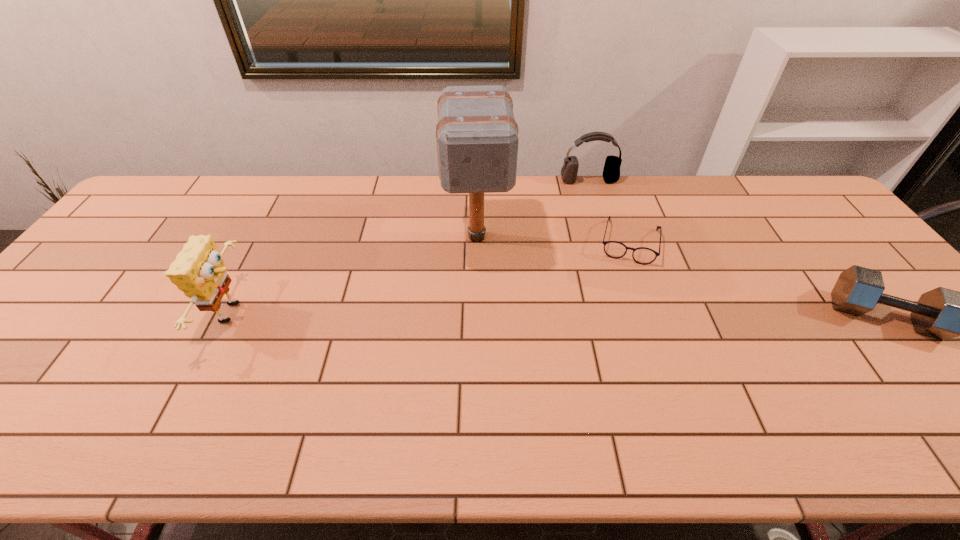
Where is `the leftmost object`? the leftmost object is located at coordinates (199, 271).

Locate an element on the screen. This screenshot has height=540, width=960. spectacles is located at coordinates (642, 255).

I want to click on the farthest object, so click(611, 173).

Locate an element on the screen. This screenshot has height=540, width=960. the third shortest object is located at coordinates (611, 173).

Identify the location of the tallest object. Image resolution: width=960 pixels, height=540 pixels. (477, 139).

The image size is (960, 540). I want to click on mallet, so (477, 139).

The height and width of the screenshot is (540, 960). Identify the location of free point located on the face of the sponge. (376, 313).

The width and height of the screenshot is (960, 540). I want to click on free point located 0.280m on the front-facing side of the spectacles, so click(x=613, y=342).

Find the location of a particular element. Image resolution: width=960 pixels, height=540 pixels. vacant area situated 0.380m on the front-facing side of the spectacles is located at coordinates (609, 377).

Find the location of `vacant space located 0.200m on the front-facing side of the spectacles`. vacant space located 0.200m on the front-facing side of the spectacles is located at coordinates (617, 318).